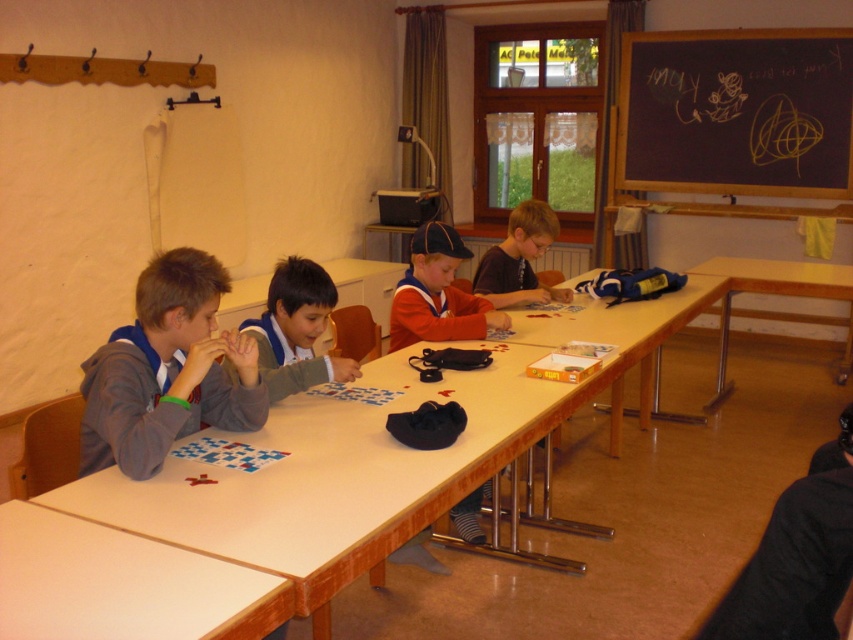
You are a teacher in the classroom and need to hand out a worksheet to the students. The worksheet is currently on the wooden table at center. You are standing next to the blue uniform shirt at center. Can you reach the worksheet without moving your position?

The wooden table at center and blue uniform shirt at center are 3.61 feet apart, so you cannot reach the worksheet without moving since the distance between them is greater than an average person can reach.

You are a teacher organizing a group activity in the classroom. You have two tables available, the wooden table at center and the wooden table at right. If you need to seat more children comfortably, which table should you choose?

The wooden table at center has a greater width than the wooden table at right, so it can accommodate more children comfortably.